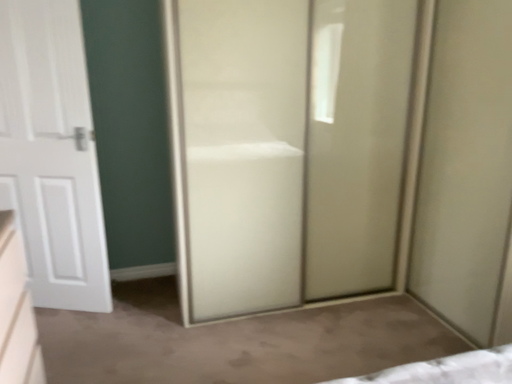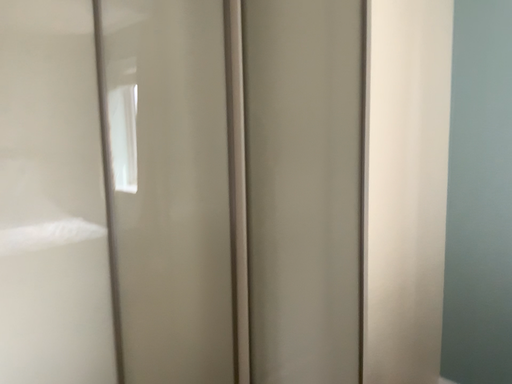
Question: Which way did the camera rotate in the video?

Choices:
 (A) rotated left
 (B) rotated right

Answer: (B)